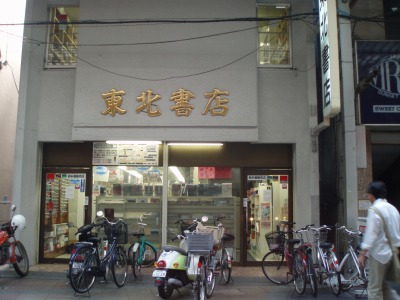
You are a GUI agent. You are given a task and a screenshot of the screen. Output one action in this format:
    pyautogui.click(x=<x>, y=<y>)
    Task: Click on the lights
    
    Given the screenshot: What is the action you would take?
    pyautogui.click(x=150, y=143)